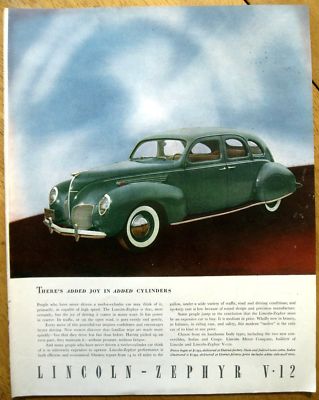
At what (x,y) coordinates should I click in order to perform the action: click on seats. Please return your answer as a coordinate pair (x, y). Looking at the image, I should click on (200, 159).